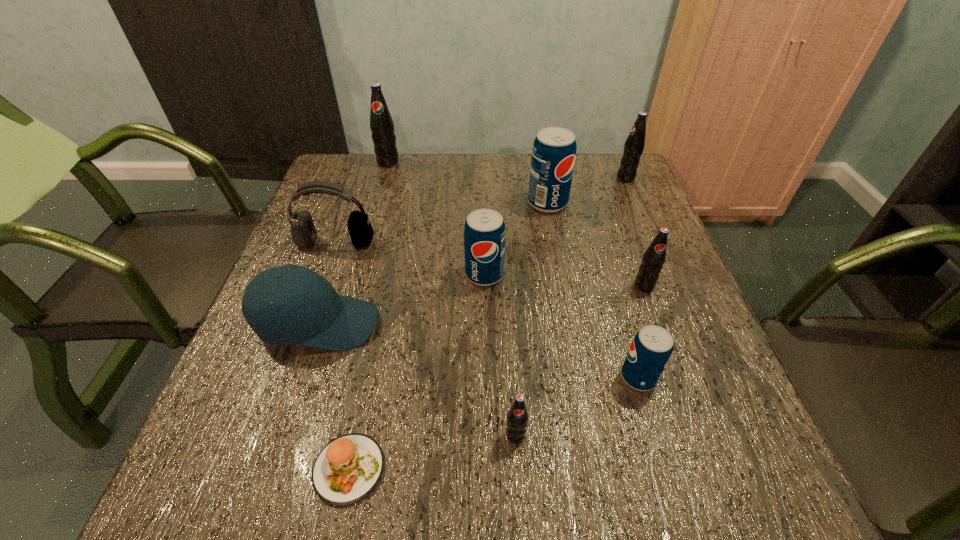
Where is `free space that is in between the seventh farthest object and the smallest black pop`? This screenshot has height=540, width=960. free space that is in between the seventh farthest object and the smallest black pop is located at coordinates [x=417, y=379].

Where is `empty space between the smallest black pop and the second farthest blue pop`? empty space between the smallest black pop and the second farthest blue pop is located at coordinates (500, 355).

At what (x,y) coordinates should I click in order to perform the action: click on object that can be found as the sixth closest to the biggest black pop. Please return your answer as a coordinate pair (x, y). Looking at the image, I should click on (654, 257).

Select which object is the seventh closest to the patty. Please provide its 2D coordinates. Your answer should be formatted as a tuple, i.e. [(x, y)], where the tuple contains the x and y coordinates of a point satisfying the conditions above.

[(553, 157)]

Locate which pop is the fourth closest to the shortest object. Please provide its 2D coordinates. Your answer should be formatted as a tuple, i.e. [(x, y)], where the tuple contains the x and y coordinates of a point satisfying the conditions above.

[(654, 257)]

What are the coordinates of `the third closest pop relative to the tallest object` in the screenshot? It's located at (634, 145).

Where is `the second closest black pop to the blue baseball cap`? the second closest black pop to the blue baseball cap is located at coordinates (381, 123).

Identify which black pop is the second nearest to the leftmost blue pop. Please provide its 2D coordinates. Your answer should be formatted as a tuple, i.e. [(x, y)], where the tuple contains the x and y coordinates of a point satisfying the conditions above.

[(517, 417)]

Identify which blue pop is located as the second nearest to the farthest pop. Please provide its 2D coordinates. Your answer should be formatted as a tuple, i.e. [(x, y)], where the tuple contains the x and y coordinates of a point satisfying the conditions above.

[(484, 233)]

Find the location of a particular element. The image size is (960, 540). blue pop that is the second closest to the fourth farthest object is located at coordinates (553, 157).